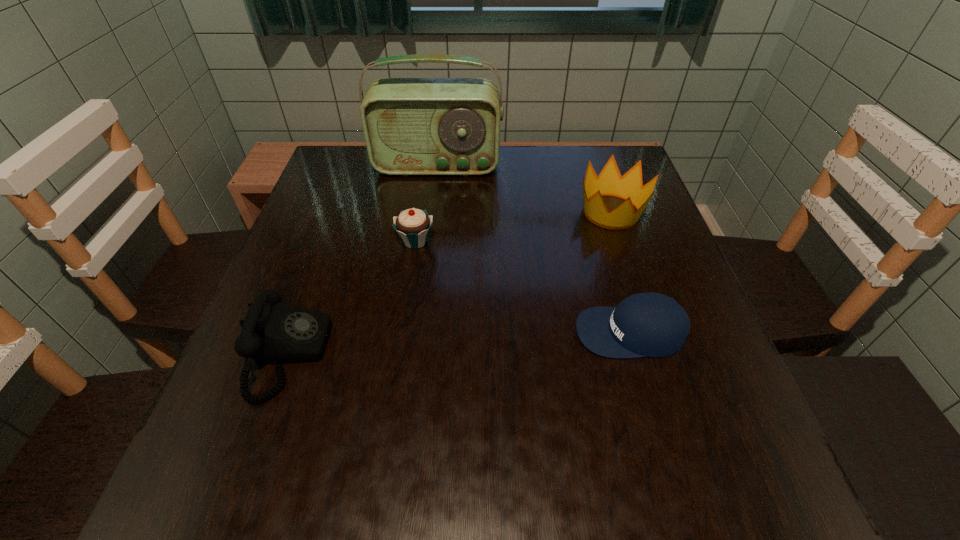
This screenshot has width=960, height=540. In order to click on vacant area located 0.120m on the front-facing side of the baseball cap in this screenshot , I will do `click(511, 332)`.

I want to click on free location located on the front-facing side of the baseball cap, so click(500, 332).

At what (x,y) coordinates should I click in order to perform the action: click on free space located 0.220m on the front-facing side of the baseball cap. Please return your answer as a coordinate pair (x, y). This screenshot has width=960, height=540. Looking at the image, I should click on (457, 332).

Locate an element on the screen. radio receiver present at the far edge is located at coordinates (412, 126).

At what (x,y) coordinates should I click in order to perform the action: click on crown that is positioned at the far edge. Please return your answer as a coordinate pair (x, y). The height and width of the screenshot is (540, 960). Looking at the image, I should click on (609, 182).

The height and width of the screenshot is (540, 960). I want to click on radio receiver located at the left edge, so click(412, 126).

Where is `telephone present at the left edge`? telephone present at the left edge is located at coordinates (272, 331).

The height and width of the screenshot is (540, 960). Identify the location of crown that is positioned at the right edge. (609, 182).

Find the location of a particular element. The height and width of the screenshot is (540, 960). baseball cap that is positioned at the right edge is located at coordinates (651, 324).

What are the coordinates of `object that is at the far left corner` in the screenshot? It's located at (412, 126).